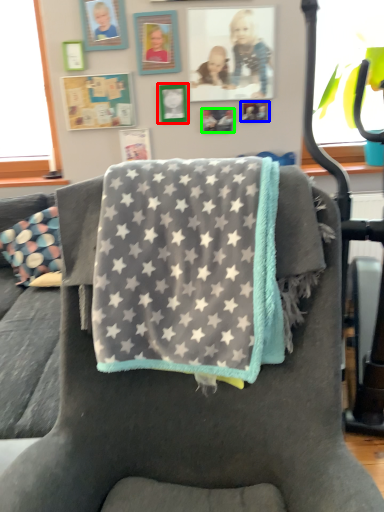
Question: Which object is positioned closest to picture frame (highlighted by a red box)? Select from picture frame (highlighted by a blue box) and picture frame (highlighted by a green box).

Choices:
 (A) picture frame
 (B) picture frame

Answer: (B)